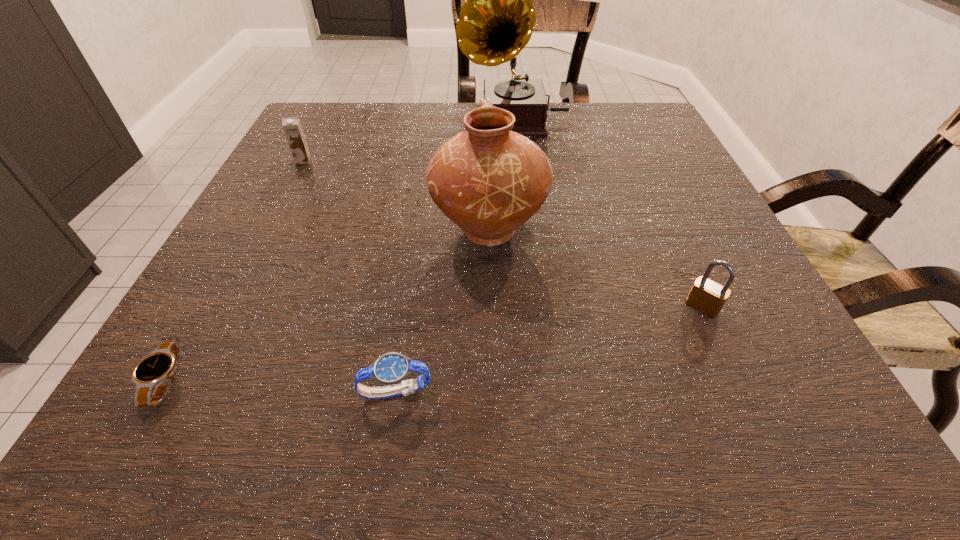
Find the location of `free point between the fifth tallest object and the shortest object`. free point between the fifth tallest object and the shortest object is located at coordinates (280, 387).

The width and height of the screenshot is (960, 540). I want to click on free space between the farthest object and the rightmost object, so click(608, 214).

At what (x,y) coordinates should I click in order to perform the action: click on free space between the shorter watch and the tallest object. Please return your answer as a coordinate pair (x, y). Looking at the image, I should click on (339, 251).

At what (x,y) coordinates should I click in order to perform the action: click on the fourth closest object to the fifth tallest object. Please return your answer as a coordinate pair (x, y). The image size is (960, 540). Looking at the image, I should click on (292, 127).

Select which object is the fourth closest to the phonograph record. Please provide its 2D coordinates. Your answer should be formatted as a tuple, i.e. [(x, y)], where the tuple contains the x and y coordinates of a point satisfying the conditions above.

[(392, 368)]

Locate an element on the screen. vacant space that satisfies the following two spatial constraints: 1. on the front side of the taller watch; 2. on the right side of the shortest object is located at coordinates (158, 392).

Find the location of a particular element. The width and height of the screenshot is (960, 540). free space that satisfies the following two spatial constraints: 1. on the front side of the chocolate milk; 2. on the left side of the taller watch is located at coordinates (182, 392).

Locate an element on the screen. This screenshot has width=960, height=540. vacant region that satisfies the following two spatial constraints: 1. on the front side of the second farthest object; 2. on the right side of the padlock is located at coordinates (227, 307).

At what (x,y) coordinates should I click in order to perform the action: click on free space in the image that satisfies the following two spatial constraints: 1. from the horn of the padlock; 2. on the left side of the phonograph record. Please return your answer as a coordinate pair (x, y). Looking at the image, I should click on (534, 307).